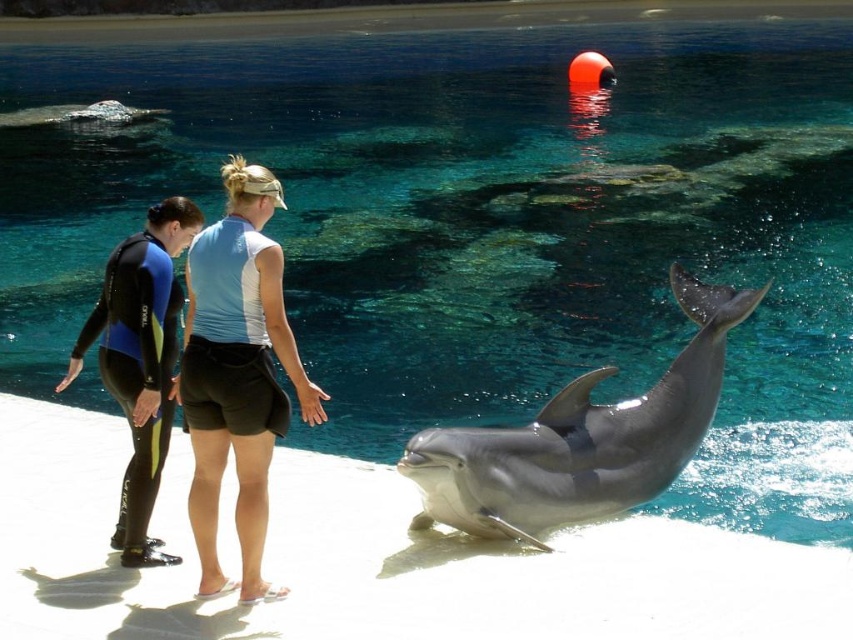
Which is below, smooth gray dolphin at center or blue fabric shorts at center?

Positioned lower is smooth gray dolphin at center.

Image resolution: width=853 pixels, height=640 pixels. Find the location of `smooth gray dolphin at center`. smooth gray dolphin at center is located at coordinates (581, 440).

The image size is (853, 640). What are the coordinates of `smooth gray dolphin at center` in the screenshot? It's located at [x=581, y=440].

Where is `smooth gray dolphin at center`? smooth gray dolphin at center is located at coordinates (581, 440).

Who is more distant from viewer, (267, 401) or (125, 252)?

The point (125, 252) is behind.

Can you confirm if blue fabric shorts at center is positioned to the left of black neoprene wetsuit at left?

Incorrect, blue fabric shorts at center is not on the left side of black neoprene wetsuit at left.

Locate an element on the screen. blue fabric shorts at center is located at coordinates (238, 372).

Looking at this image, between smooth gray dolphin at center and black neoprene wetsuit at left, which one has less height?

smooth gray dolphin at center

Which is in front, point (558, 468) or point (125, 493)?

Point (125, 493) is in front.

Between point (605, 456) and point (140, 342), which one is positioned in front?

Point (140, 342) is more forward.

You are a GUI agent. You are given a task and a screenshot of the screen. Output one action in this format:
    pyautogui.click(x=<x>, y=<y>)
    Task: Click on the smooth gray dolphin at center
    This screenshot has height=640, width=853.
    Given the screenshot: What is the action you would take?
    pyautogui.click(x=581, y=440)